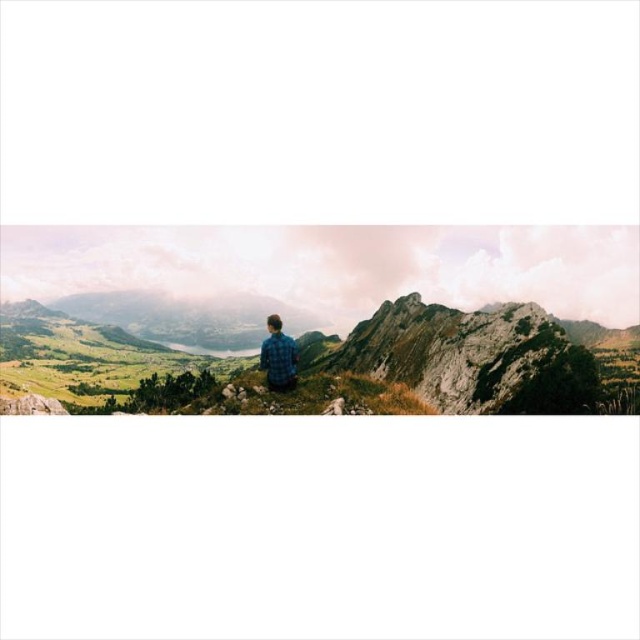
Question: Does rugged rock peak at center have a lesser width compared to blue plaid shirt at center?

Choices:
 (A) yes
 (B) no

Answer: (B)

Question: Which of the following is the farthest from the observer?

Choices:
 (A) blue plaid shirt at center
 (B) rugged rock peak at center

Answer: (B)

Question: Which point appears closest to the camera in this image?

Choices:
 (A) (275, 364)
 (B) (428, 326)

Answer: (A)

Question: Which object appears closest to the camera in this image?

Choices:
 (A) rugged rock peak at center
 (B) blue plaid shirt at center

Answer: (B)

Question: Is rugged rock peak at center above blue plaid shirt at center?

Choices:
 (A) no
 (B) yes

Answer: (B)

Question: Is rugged rock peak at center to the left of blue plaid shirt at center from the viewer's perspective?

Choices:
 (A) no
 (B) yes

Answer: (A)